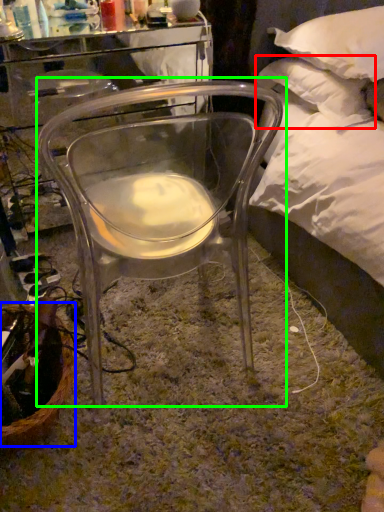
Question: Considering the real-world distances, which object is farthest from pillow (highlighted by a red box)? basket (highlighted by a blue box) or chair (highlighted by a green box)?

Choices:
 (A) basket
 (B) chair

Answer: (A)